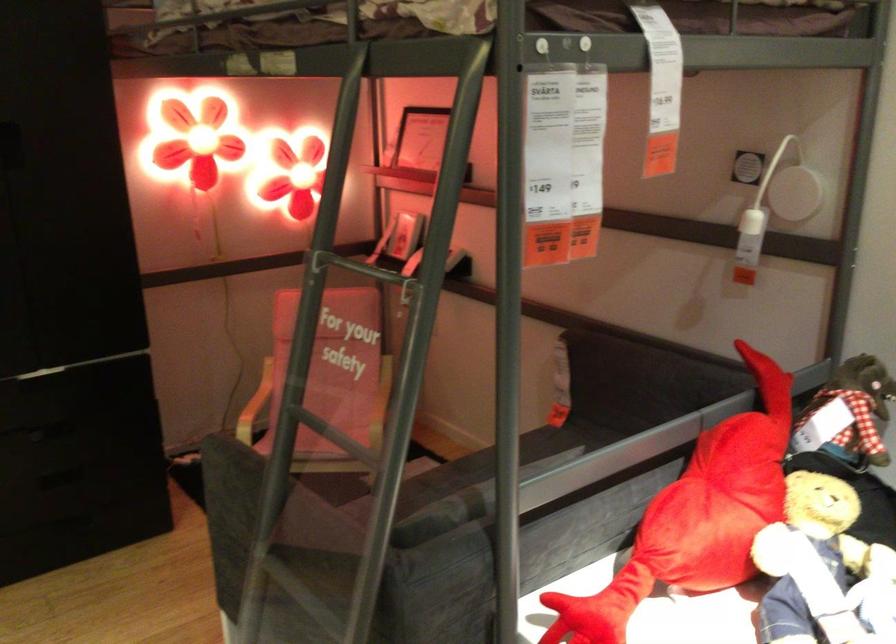
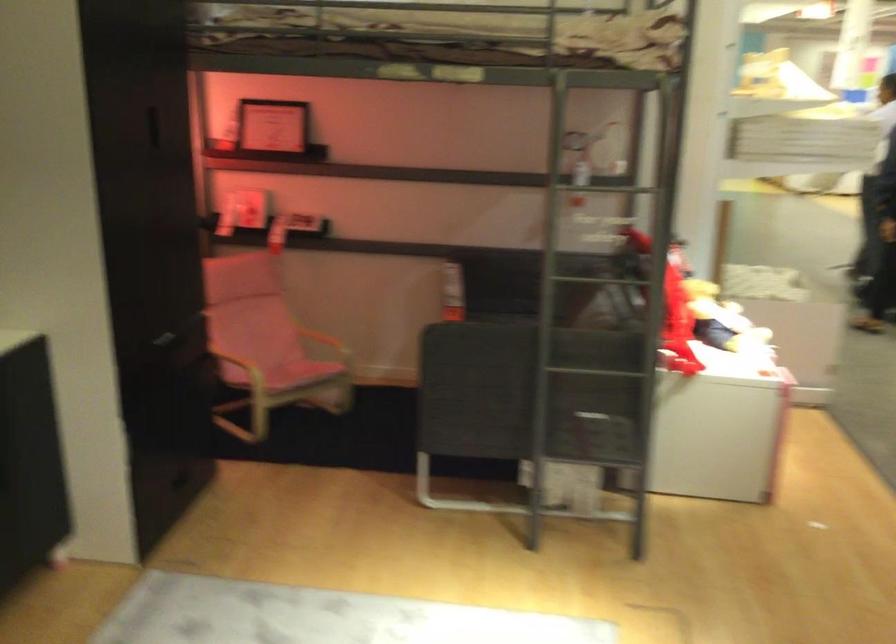
Where in the second image is the point corresponding to (x=716, y=263) from the first image?

(591, 183)